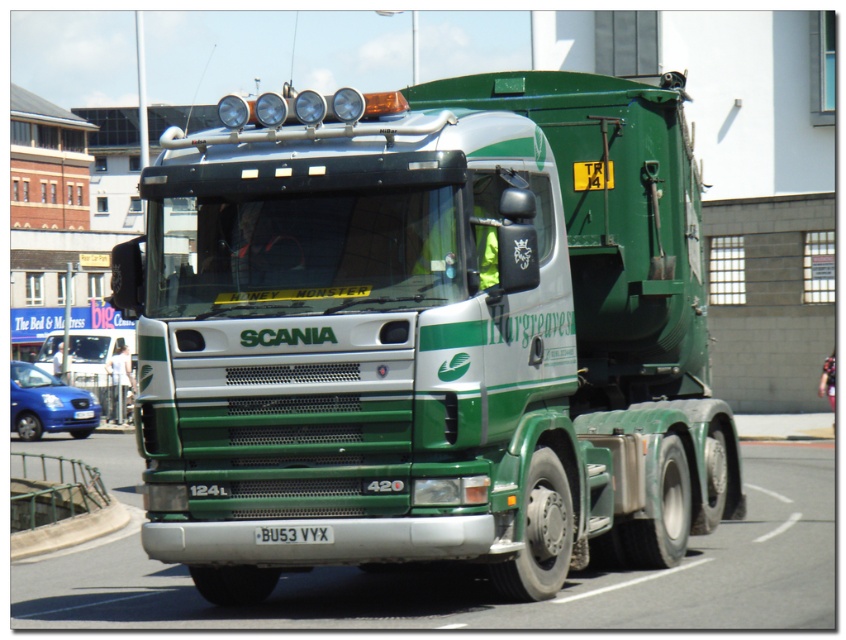
Question: Which point is closer to the camera?

Choices:
 (A) black plastic license plate at center
 (B) green matte truck at center

Answer: (B)

Question: Is the position of green matte truck at center more distant than that of black plastic license plate at center?

Choices:
 (A) yes
 (B) no

Answer: (B)

Question: Which point is closer to the camera taking this photo?

Choices:
 (A) (581, 448)
 (B) (301, 531)

Answer: (B)

Question: Is green matte truck at center bigger than black plastic license plate at center?

Choices:
 (A) yes
 (B) no

Answer: (A)

Question: Can you confirm if green matte truck at center is positioned above black plastic license plate at center?

Choices:
 (A) yes
 (B) no

Answer: (A)